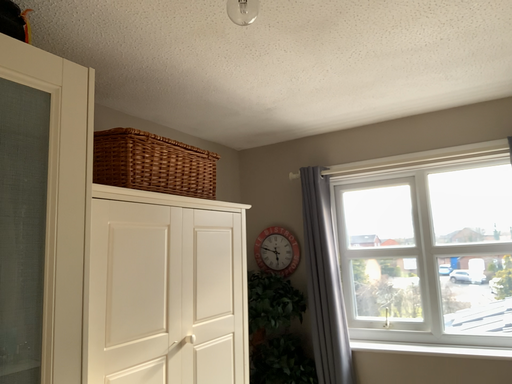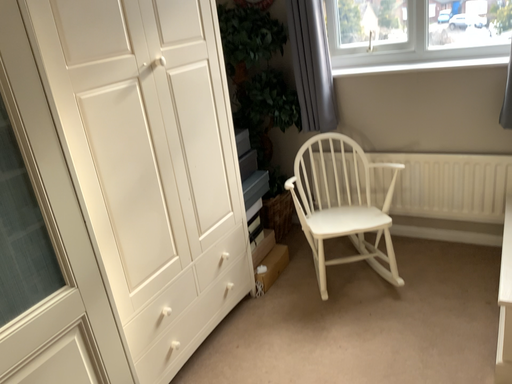
Question: How did the camera likely rotate when shooting the video?

Choices:
 (A) rotated downward
 (B) rotated upward

Answer: (A)